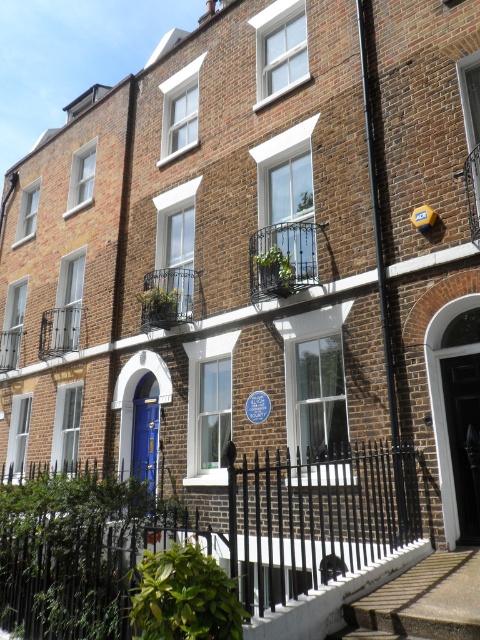
Question: Which of the following is the closest to the observer?

Choices:
 (A) blue glossy door at center
 (B) black wrought iron fence at center

Answer: (B)

Question: Based on their relative distances, which object is farther from the black matte door at center?

Choices:
 (A) blue glossy door at center
 (B) black wrought iron fence at center

Answer: (A)

Question: Is black wrought iron fence at center to the right of blue glossy door at center from the viewer's perspective?

Choices:
 (A) no
 (B) yes

Answer: (B)

Question: Which of the following is the farthest from the observer?

Choices:
 (A) blue glossy door at center
 (B) black wrought iron fence at center
 (C) black matte door at center

Answer: (A)

Question: Is black matte door at center above blue glossy door at center?

Choices:
 (A) no
 (B) yes

Answer: (B)

Question: Can you confirm if black wrought iron fence at center is bigger than black matte door at center?

Choices:
 (A) no
 (B) yes

Answer: (B)